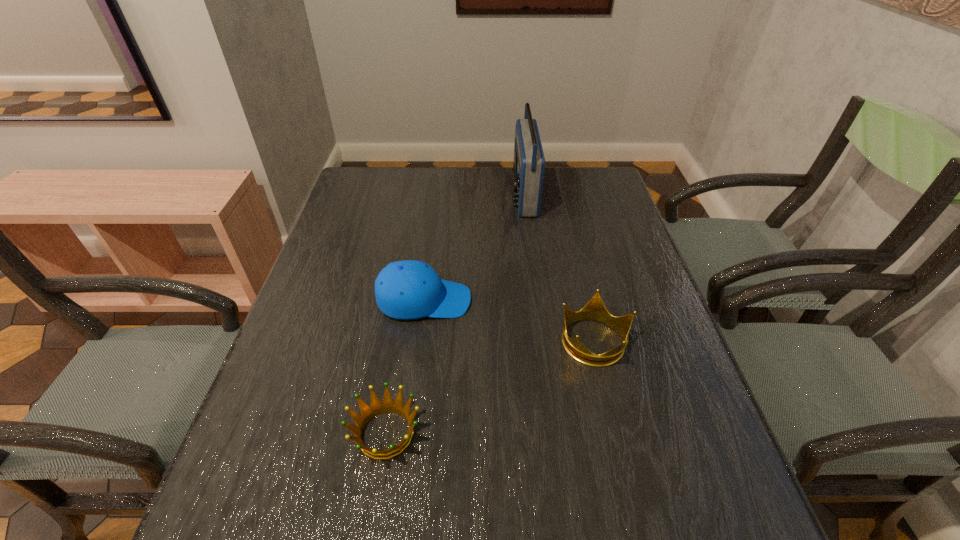
Identify the location of blank area in the image that satisfies the following two spatial constraints: 1. on the back side of the right crown; 2. on the front-facing side of the second tallest object. The image size is (960, 540). (585, 300).